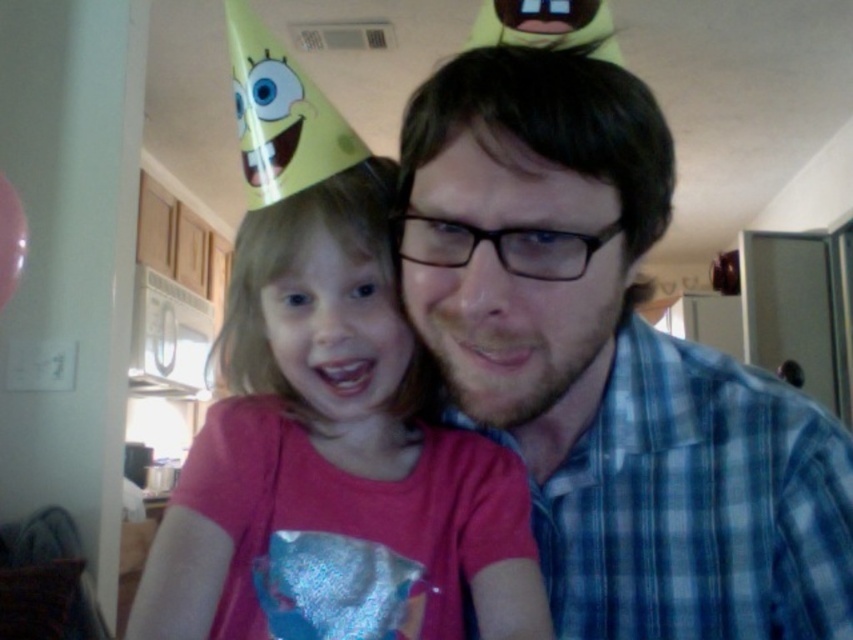
Question: Which point is closer to the camera?

Choices:
 (A) (297, 380)
 (B) (599, 490)

Answer: (A)

Question: Does blue plaid shirt at center appear over pink matte shirt at center?

Choices:
 (A) yes
 (B) no

Answer: (A)

Question: Which point is closer to the camera?

Choices:
 (A) (233, 522)
 (B) (630, 474)

Answer: (A)

Question: Does blue plaid shirt at center have a lesser width compared to pink matte shirt at center?

Choices:
 (A) no
 (B) yes

Answer: (A)

Question: Considering the relative positions of blue plaid shirt at center and pink matte shirt at center in the image provided, where is blue plaid shirt at center located with respect to pink matte shirt at center?

Choices:
 (A) right
 (B) left

Answer: (A)